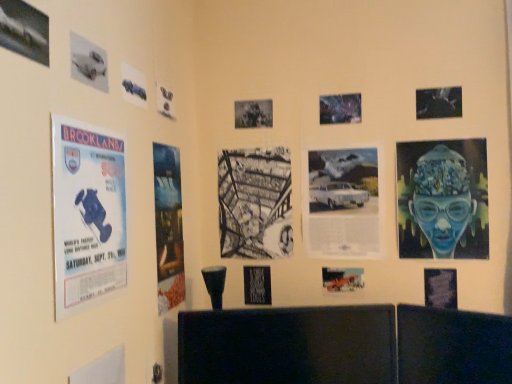
Question: From the image's perspective, does black paper at center, acting as the eighth poster starting from the right, appear lower than white paper at center, placed as the fourth poster when sorted from right to left?

Choices:
 (A) yes
 (B) no

Answer: (B)

Question: Considering the relative sizes of black paper at center, which is counted as the seventh poster, starting from the left, and white paper at center, placed as the fourth poster when sorted from right to left, in the image provided, is black paper at center, which is counted as the seventh poster, starting from the left, thinner than white paper at center, placed as the fourth poster when sorted from right to left,?

Choices:
 (A) no
 (B) yes

Answer: (A)

Question: Is black paper at center, acting as the eighth poster starting from the right, bigger than white paper at center, which is the 11th poster from left to right?

Choices:
 (A) no
 (B) yes

Answer: (A)

Question: Considering the relative sizes of black paper at center, which is counted as the seventh poster, starting from the left, and white paper at center, placed as the fourth poster when sorted from right to left, in the image provided, is black paper at center, which is counted as the seventh poster, starting from the left, shorter than white paper at center, placed as the fourth poster when sorted from right to left,?

Choices:
 (A) no
 (B) yes

Answer: (B)

Question: Is black paper at center, acting as the eighth poster starting from the right, at the left side of white paper at center, placed as the fourth poster when sorted from right to left?

Choices:
 (A) no
 (B) yes

Answer: (B)

Question: Choose the correct answer: Is black paper at center, acting as the eighth poster starting from the left, inside black paper at center, acting as the eighth poster starting from the right, or outside it?

Choices:
 (A) inside
 (B) outside

Answer: (B)

Question: In the image, is black paper at center, placed as the seventh poster when sorted from right to left, positioned in front of or behind black paper at center, which is counted as the seventh poster, starting from the left?

Choices:
 (A) front
 (B) behind

Answer: (A)

Question: In terms of width, does black paper at center, placed as the seventh poster when sorted from right to left, look wider or thinner when compared to black paper at center, which is counted as the seventh poster, starting from the left?

Choices:
 (A) thin
 (B) wide

Answer: (A)

Question: From the image's perspective, is black paper at center, acting as the eighth poster starting from the left, above or below black paper at center, acting as the eighth poster starting from the right?

Choices:
 (A) below
 (B) above

Answer: (A)

Question: Visually, is blue paper poster at left, arranged as the 12th poster when viewed from the right, positioned to the left or to the right of metallic blue car at upper left, the fourth poster from the left?

Choices:
 (A) left
 (B) right

Answer: (A)

Question: In terms of width, does blue paper poster at left, arranged as the 12th poster when viewed from the right, look wider or thinner when compared to metallic blue car at upper left, the eleventh poster in the right-to-left sequence?

Choices:
 (A) wide
 (B) thin

Answer: (A)

Question: Considering their positions, is blue paper poster at left, marked as the third poster in a left-to-right arrangement, located in front of or behind metallic blue car at upper left, the eleventh poster in the right-to-left sequence?

Choices:
 (A) behind
 (B) front

Answer: (B)

Question: Choose the correct answer: Is blue paper poster at left, arranged as the 12th poster when viewed from the right, inside metallic blue car at upper left, the eleventh poster in the right-to-left sequence, or outside it?

Choices:
 (A) inside
 (B) outside

Answer: (B)

Question: From their relative heights in the image, would you say metallic silver poster at upper center, which is the sixth poster in right-to-left order, is taller or shorter than black glossy tv at lower center?

Choices:
 (A) short
 (B) tall

Answer: (A)

Question: Is point (x=348, y=107) positioned closer to the camera than point (x=318, y=340)?

Choices:
 (A) closer
 (B) farther

Answer: (B)